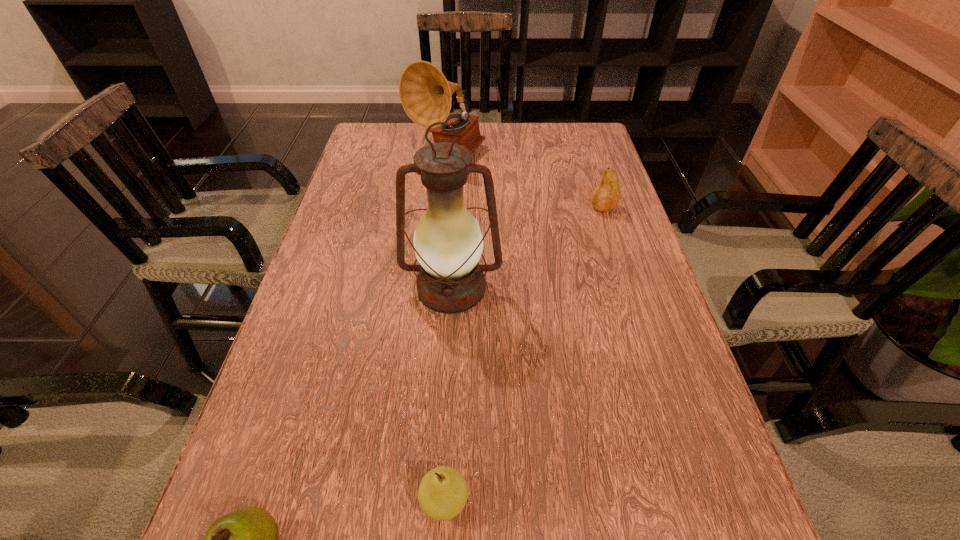
Locate an element on the screen. The image size is (960, 540). vacant space situated on the back of the rightmost object is located at coordinates (583, 143).

What are the coordinates of `vacant region located on the left of the second pear from right to left` in the screenshot? It's located at (297, 501).

In order to click on object located at the far edge in this screenshot , I will do `click(425, 94)`.

This screenshot has height=540, width=960. Find the location of `object present at the left edge`. object present at the left edge is located at coordinates (x=425, y=94).

Where is `object located in the right edge section of the desktop`? The width and height of the screenshot is (960, 540). object located in the right edge section of the desktop is located at coordinates (606, 195).

I want to click on object that is at the far left corner, so click(x=425, y=94).

Locate an element on the screen. The height and width of the screenshot is (540, 960). vacant space at the far edge of the desktop is located at coordinates (519, 152).

This screenshot has height=540, width=960. I want to click on free space at the left edge of the desktop, so click(373, 173).

At what (x,y) coordinates should I click in order to perform the action: click on vacant area at the right edge of the desktop. Please return your answer as a coordinate pair (x, y). Looking at the image, I should click on (556, 165).

Where is `free point at the far right corner`? free point at the far right corner is located at coordinates (555, 163).